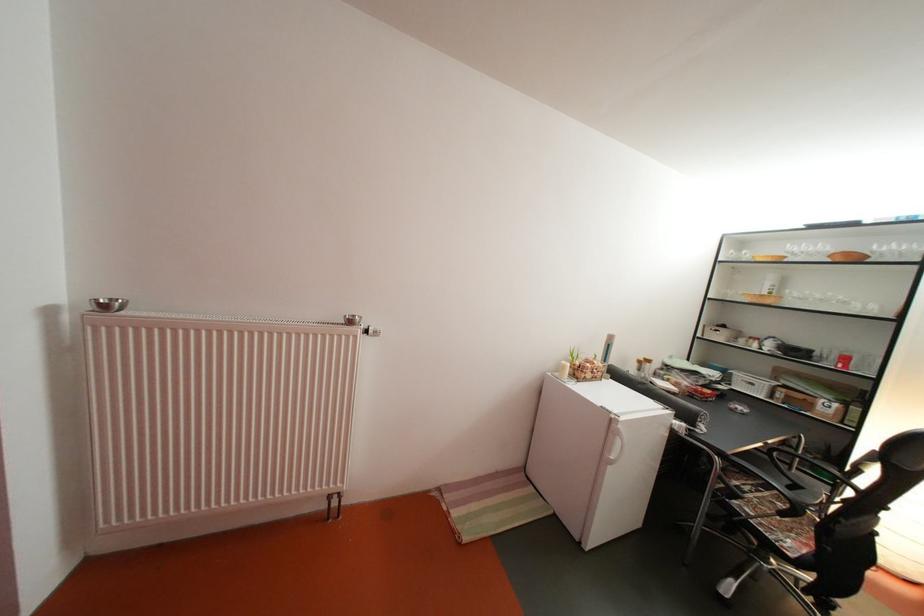
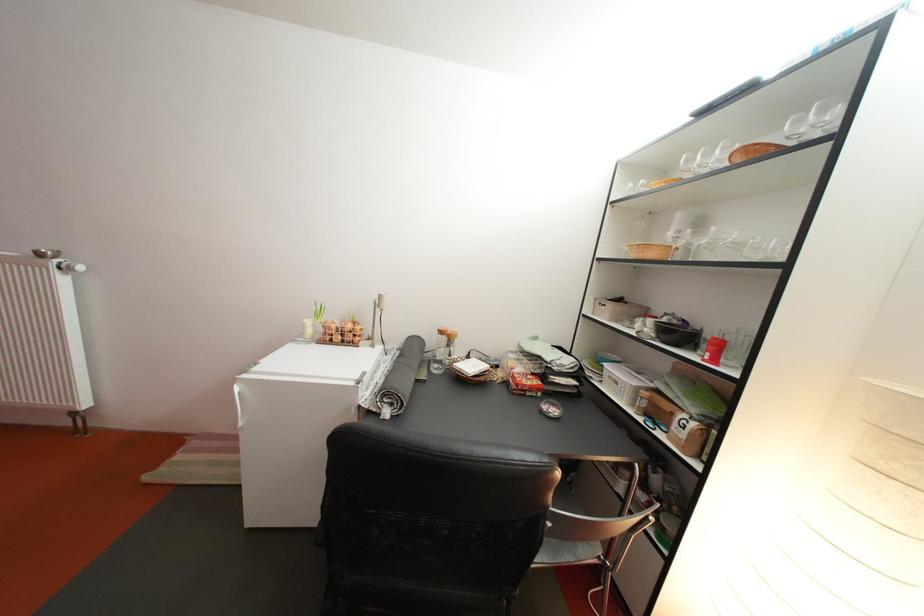
Find the pixel in the second image that matches (x=794, y=395) in the first image.

(658, 400)